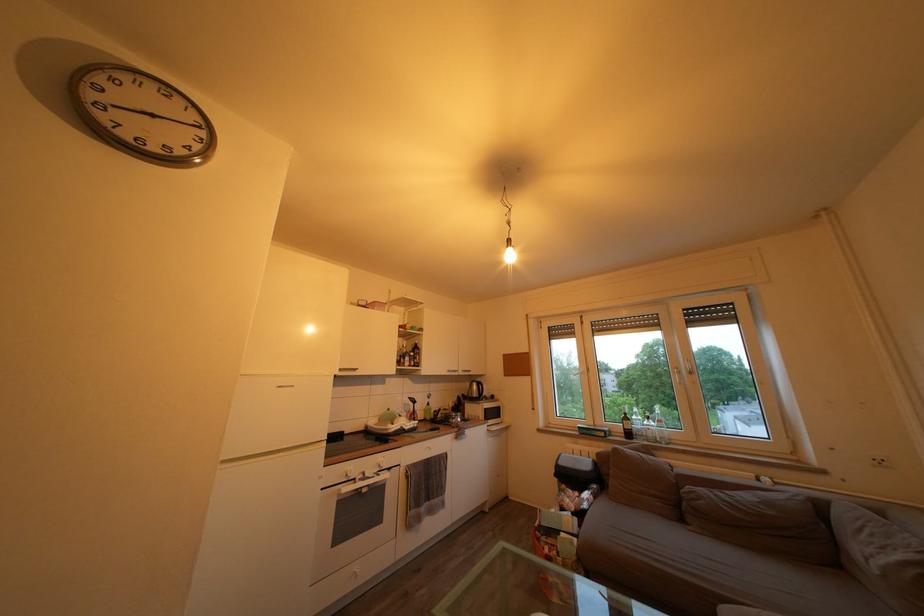
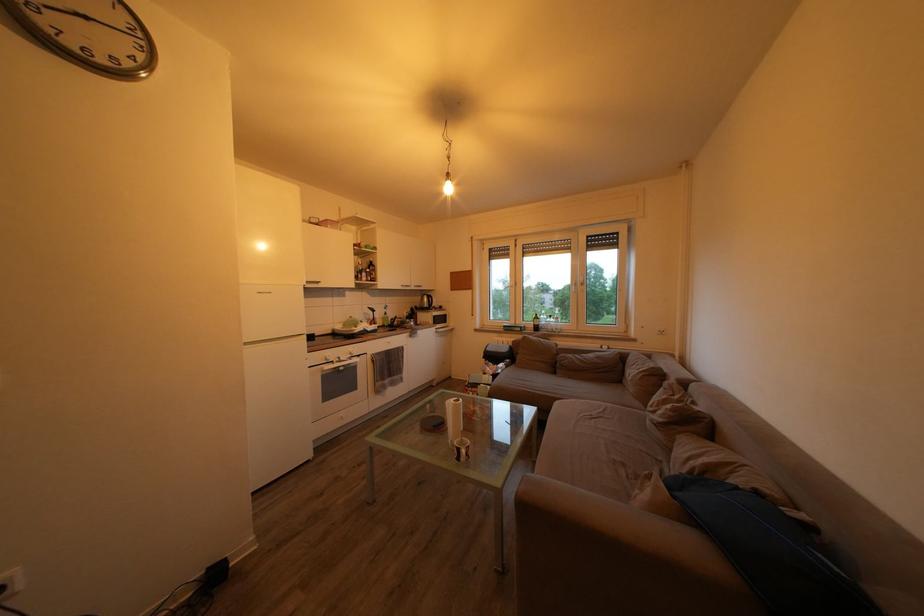
Find the pixel in the second image that matches the point at 188,158 in the first image.

(134, 69)